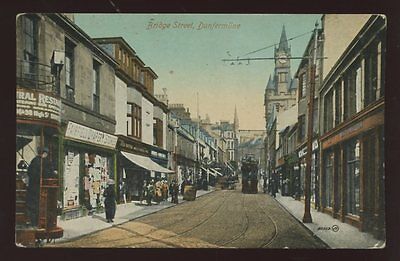
At what (x,y) coordinates should I click in order to perform the action: click on clock. Please return your answer as a coordinate pair (x, y). The height and width of the screenshot is (261, 400). Looking at the image, I should click on tap(282, 59).